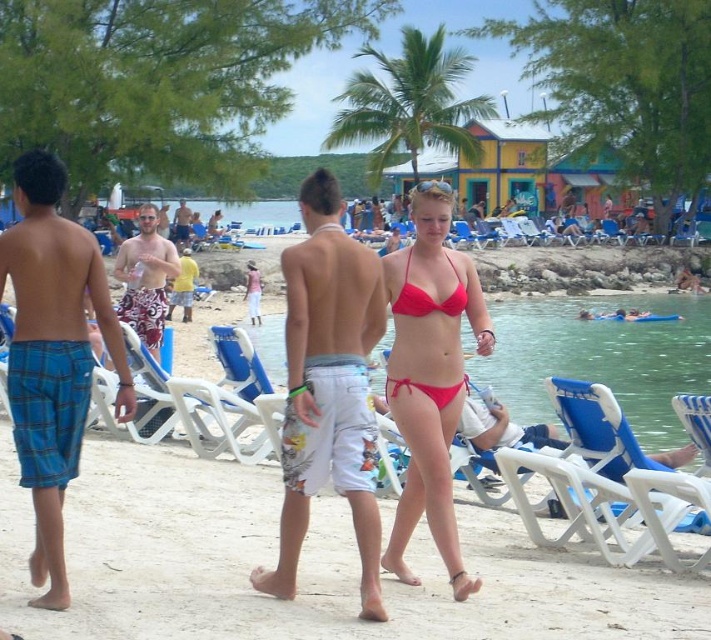
Is matte red bikini at center shorter than matte white surfboard at center?

Correct, matte red bikini at center is not as tall as matte white surfboard at center.

Does matte red bikini at center have a larger size compared to matte white surfboard at center?

No.

Is point (437, 387) positioned in front of point (187, 211)?

Yes, it is.

This screenshot has height=640, width=711. Find the location of `matte red bikini at center`. matte red bikini at center is located at coordinates (427, 296).

Does white printed shorts at center have a greater height compared to matte red bikini top at center?

Yes, white printed shorts at center is taller than matte red bikini top at center.

Can you confirm if white printed shorts at center is shorter than matte red bikini top at center?

No, white printed shorts at center is not shorter than matte red bikini top at center.

Where is `white printed shorts at center`? The width and height of the screenshot is (711, 640). white printed shorts at center is located at coordinates (328, 387).

How distant is blue plaid shorts at left from blue plastic beach chair at lower right?

blue plaid shorts at left and blue plastic beach chair at lower right are 17.21 feet apart from each other.

Can you confirm if blue plaid shorts at left is taller than blue plastic beach chair at lower right?

No, blue plaid shorts at left is not taller than blue plastic beach chair at lower right.

Is point (60, 349) positioned behind point (565, 392)?

No, (60, 349) is in front of (565, 392).

At what (x,y) coordinates should I click in order to perform the action: click on blue plaid shorts at left. Please return your answer as a coordinate pair (x, y). Image resolution: width=711 pixels, height=640 pixels. Looking at the image, I should click on (53, 355).